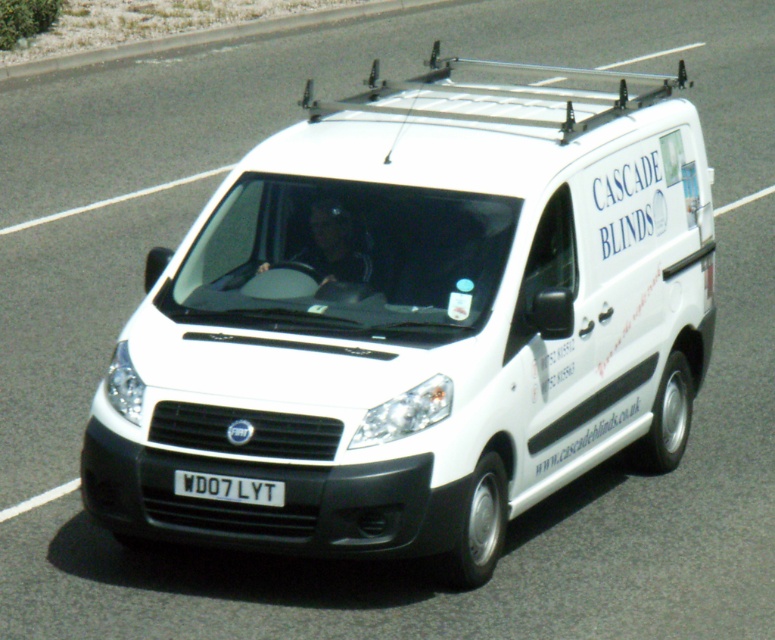
Question: Does white matte van at center appear over white plastic license plate at center?

Choices:
 (A) yes
 (B) no

Answer: (A)

Question: Where is white matte van at center located in relation to white plastic license plate at center in the image?

Choices:
 (A) below
 (B) above

Answer: (B)

Question: Considering the relative positions of white matte van at center and white plastic license plate at center in the image provided, where is white matte van at center located with respect to white plastic license plate at center?

Choices:
 (A) left
 (B) right

Answer: (B)

Question: Which point appears farthest from the camera in this image?

Choices:
 (A) (425, 177)
 (B) (188, 483)

Answer: (A)